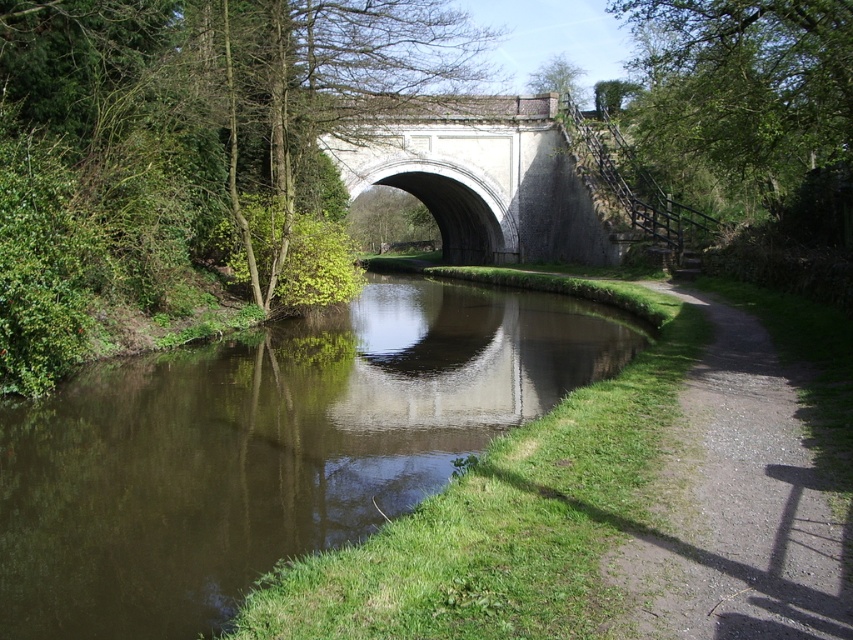
Is point (41, 467) farther from camera compared to point (752, 106)?

No, (41, 467) is in front of (752, 106).

What do you see at coordinates (265, 448) in the screenshot? I see `brown reflective water at center` at bounding box center [265, 448].

At what (x,y) coordinates should I click in order to perform the action: click on brown reflective water at center. Please return your answer as a coordinate pair (x, y). Looking at the image, I should click on (265, 448).

How distant is gravel path at lower right from white stone bridge at center?

gravel path at lower right is 31.70 meters away from white stone bridge at center.

Who is positioned more to the left, gravel path at lower right or white stone bridge at center?

Positioned to the left is white stone bridge at center.

Who is more distant from viewer, (814, 488) or (386, 122)?

The point (386, 122) is behind.

You are a GUI agent. You are given a task and a screenshot of the screen. Output one action in this format:
    pyautogui.click(x=<x>, y=<y>)
    Task: Click on the gravel path at lower right
    
    Given the screenshot: What is the action you would take?
    pyautogui.click(x=735, y=506)

Between point (764, 8) and point (527, 77), which one is positioned behind?

Point (527, 77)

Does green leafy tree at upper right appear on the right side of green leafy tree at upper center?

Yes, green leafy tree at upper right is to the right of green leafy tree at upper center.

Between point (686, 120) and point (576, 68), which one is positioned in front?

Point (686, 120)

The height and width of the screenshot is (640, 853). I want to click on green leafy tree at upper right, so click(743, 90).